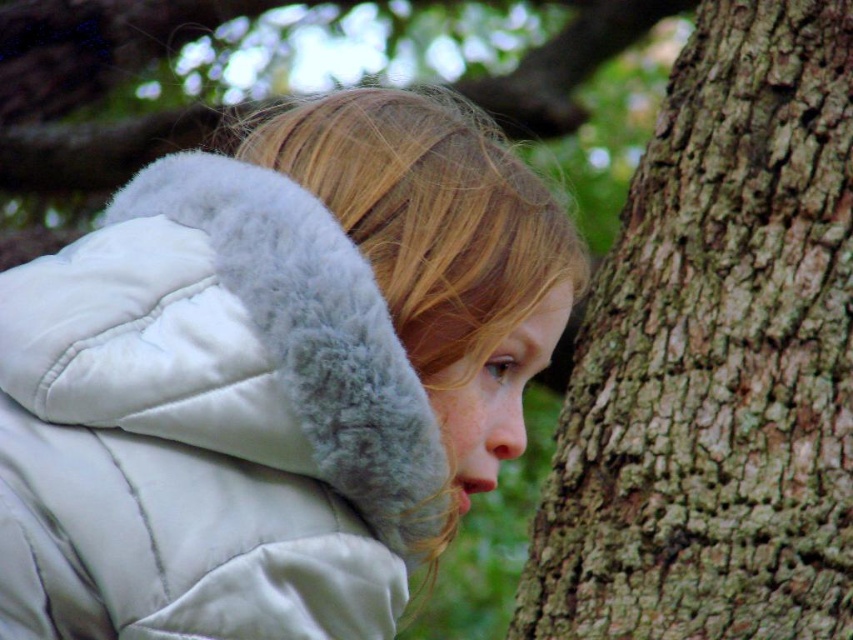
Between point (103, 355) and point (549, 496), which one is positioned behind?

Point (549, 496)

Does white puffy jacket at center have a lesser width compared to brown rough bark at right?

Indeed, white puffy jacket at center has a lesser width compared to brown rough bark at right.

This screenshot has width=853, height=640. Identify the location of white puffy jacket at center. (274, 376).